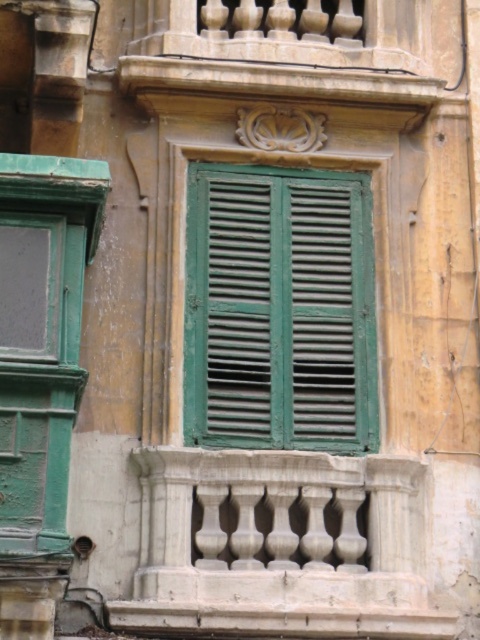
Is point (207, 259) positioned before point (0, 552)?

No, (207, 259) is behind (0, 552).

Who is positioned more to the left, green matte shutters at center or green matte door at left?

green matte door at left

Locate an element on the screen. green matte shutters at center is located at coordinates (279, 308).